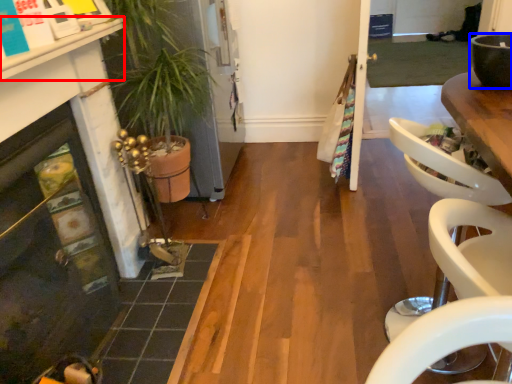
Question: Which object is further to the camera taking this photo, counter top (highlighted by a red box) or bowl (highlighted by a blue box)?

Choices:
 (A) counter top
 (B) bowl

Answer: (B)